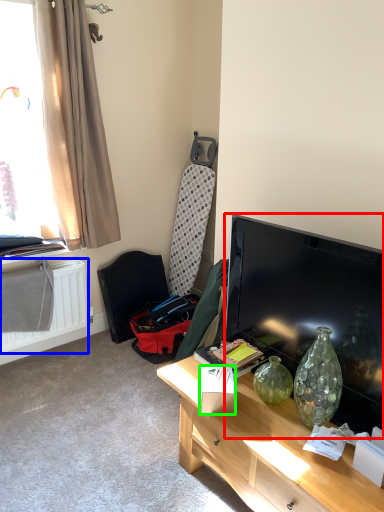
Question: Based on their relative distances, which object is farther from television (highlighted by a red box)? Choose from radiator (highlighted by a blue box) and box (highlighted by a green box).

Choices:
 (A) radiator
 (B) box

Answer: (A)